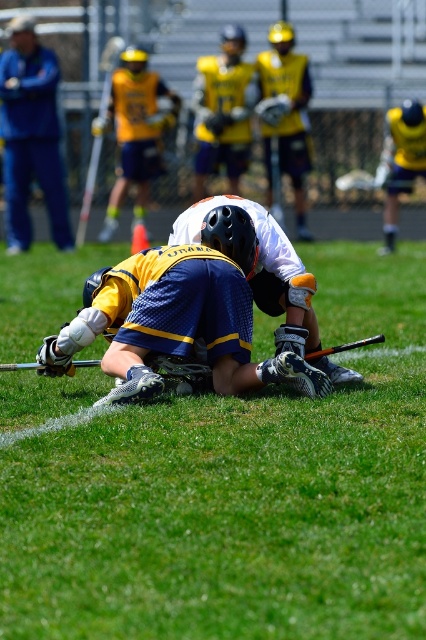
You are a referee in a lacrosse game. You notice a point at coordinate (x=238, y=496) on the field. Based on the scene, what object or area is this point located on?

The point at coordinate (x=238, y=496) is located on the blue fabric jersey at center.

Based on the photo, you are a sports analyst watching the lacrosse game. You need to locate the blue fabric jersey at center on the field. Where exactly is it positioned?

The blue fabric jersey at center is positioned at point [238,496] on the field.